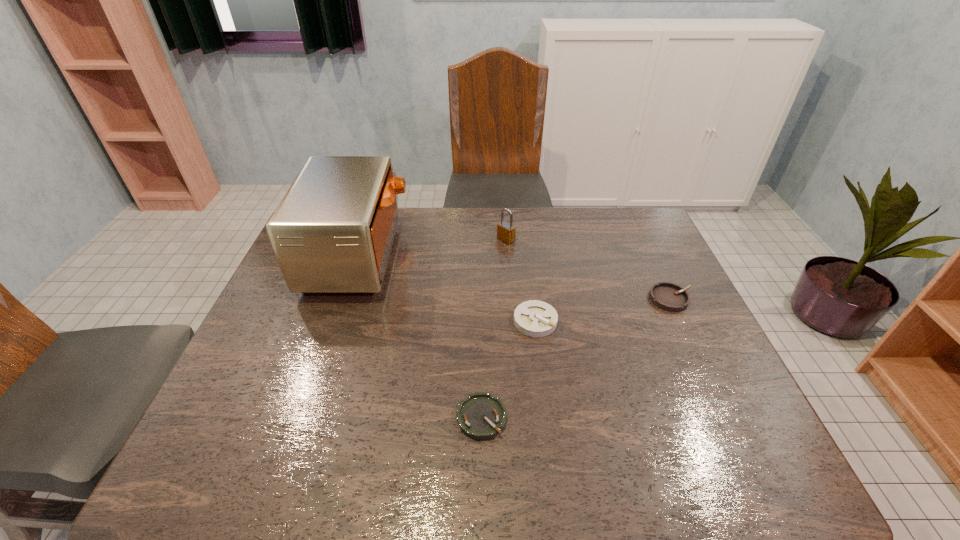
Identify the location of free point at the left edge. (322, 309).

In the image, there is a desktop. What are the coordinates of `vacant space at the right edge` in the screenshot? It's located at (660, 313).

You are a GUI agent. You are given a task and a screenshot of the screen. Output one action in this format:
    pyautogui.click(x=<x>, y=<y>)
    Task: Click on the vacant space at the near right corner of the desktop
    The width and height of the screenshot is (960, 540).
    Given the screenshot: What is the action you would take?
    pyautogui.click(x=715, y=469)

In order to click on free spot between the nearest object and the rightmost ashtray in this screenshot , I will do `click(576, 358)`.

You are a GUI agent. You are given a task and a screenshot of the screen. Output one action in this format:
    pyautogui.click(x=<x>, y=<y>)
    Task: Click on the vacant space that's between the shortest object and the second tallest object
    
    Given the screenshot: What is the action you would take?
    pyautogui.click(x=493, y=328)

Identify the location of free point between the second ashtray from right to left and the shortest ashtray. This screenshot has width=960, height=540. (509, 369).

The height and width of the screenshot is (540, 960). Find the location of `free space between the leftmost object and the nearest ashtray`. free space between the leftmost object and the nearest ashtray is located at coordinates (420, 336).

Image resolution: width=960 pixels, height=540 pixels. I want to click on free space that is in between the rightmost object and the shortest object, so click(x=576, y=358).

Where is `free space between the rightmost object and the second ashtray from left to right`? Image resolution: width=960 pixels, height=540 pixels. free space between the rightmost object and the second ashtray from left to right is located at coordinates (603, 310).

In order to click on vacant area between the tallest object and the second ashtray from right to left in this screenshot , I will do `click(447, 288)`.